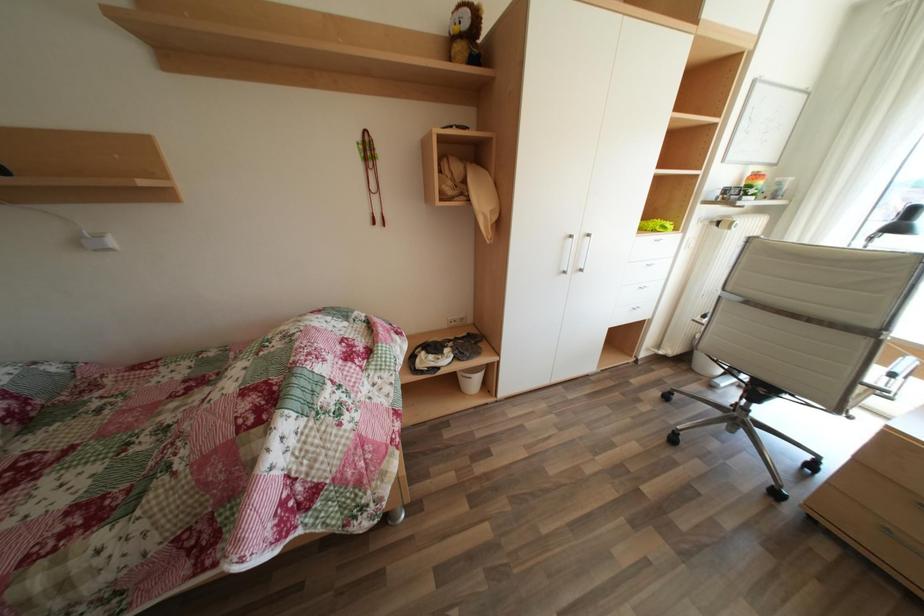
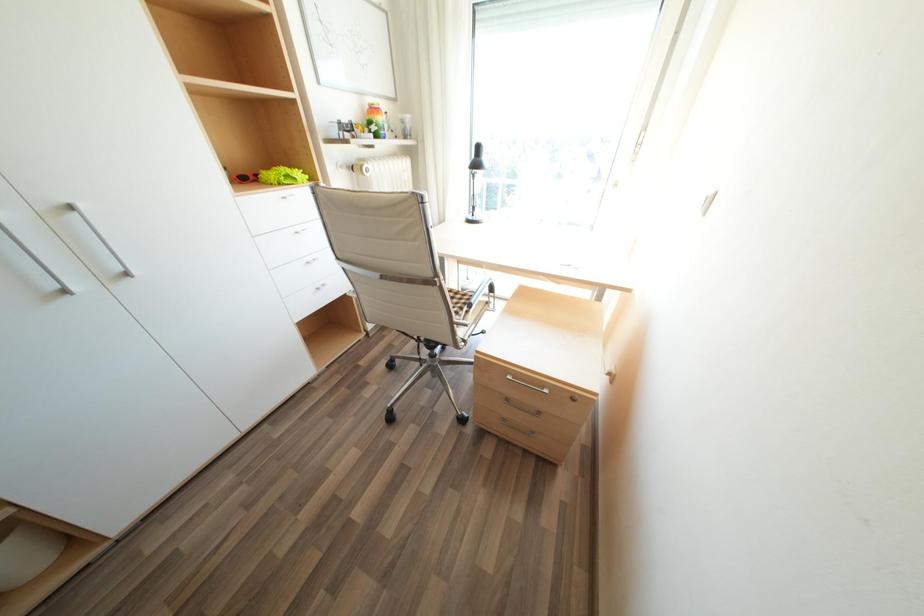
How did the camera likely rotate?

The rotation direction of the camera is right-down.